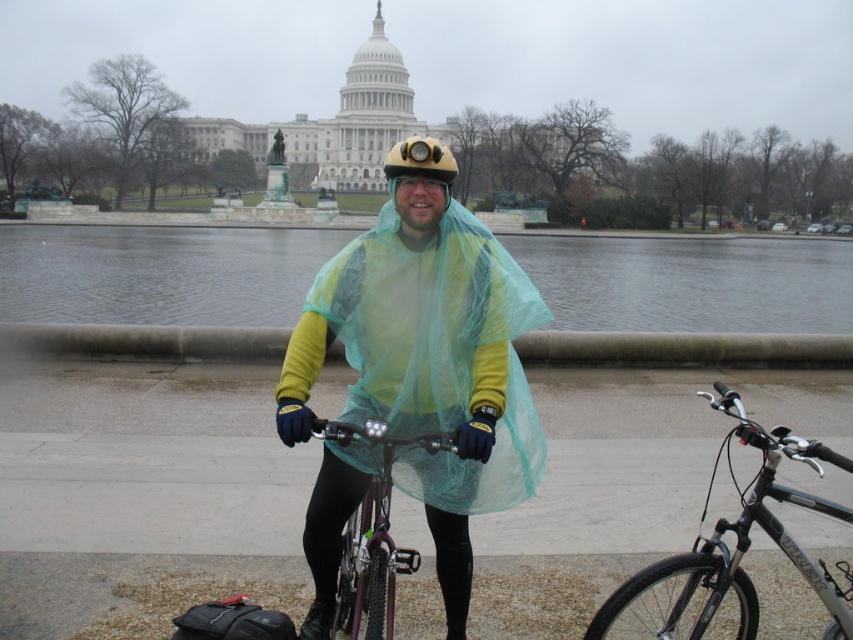
You are a cyclist who wants to check if your gear is properly arranged. You have a translucent green poncho at center and a yellow matte helmet at center. Which item is shorter?

The translucent green poncho at center is shorter than the yellow matte helmet at center.

You are planning to take a photo of the iconic building in the background. You have a camera with a limited field of view. The translucent green poncho at center and the shiny purple bicycle at center are in the way. Which object should you move to get a clearer view of the building?

The translucent green poncho at center might be wider than the shiny purple bicycle at center, so moving the poncho first would likely provide a clearer view of the iconic building in the background.

You are a delivery person who needs to pack both the translucent green poncho at center and the yellow matte helmet at center into a small backpack. Based on their sizes, which item should you place first into the backpack?

The translucent green poncho at center occupies less space than the yellow matte helmet at center, so you should place the yellow matte helmet at center first to make room for the smaller item.